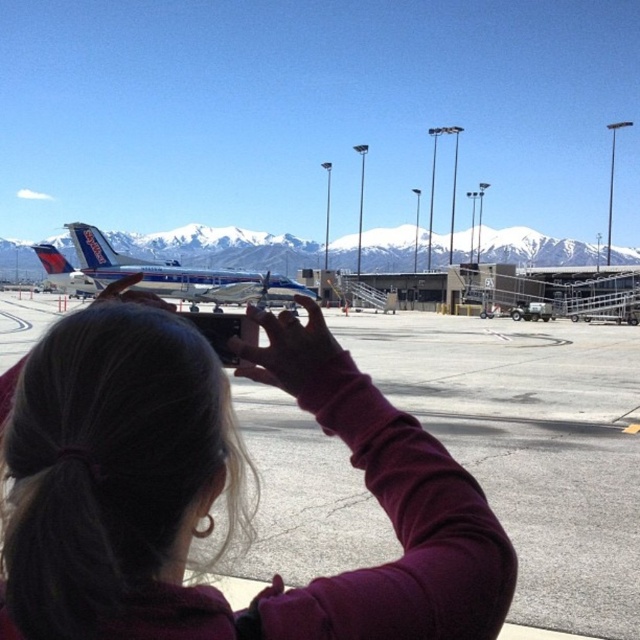
Question: Can you confirm if snowy mountain at center is positioned above blue metallic airplane at center?

Choices:
 (A) no
 (B) yes

Answer: (B)

Question: Which point appears closest to the camera in this image?

Choices:
 (A) (x=419, y=483)
 (B) (x=531, y=237)
 (C) (x=241, y=292)

Answer: (A)

Question: Which point is farther to the camera?

Choices:
 (A) dark purple sweater at center
 (B) blue metallic airplane at center

Answer: (B)

Question: Is dark purple sweater at center bigger than blue metallic airplane at center?

Choices:
 (A) yes
 (B) no

Answer: (B)

Question: Considering the relative positions of dark purple sweater at center and blue metallic airplane at center in the image provided, where is dark purple sweater at center located with respect to blue metallic airplane at center?

Choices:
 (A) below
 (B) above

Answer: (A)

Question: Which object appears closest to the camera in this image?

Choices:
 (A) dark purple sweater at center
 (B) snowy mountain at center

Answer: (A)